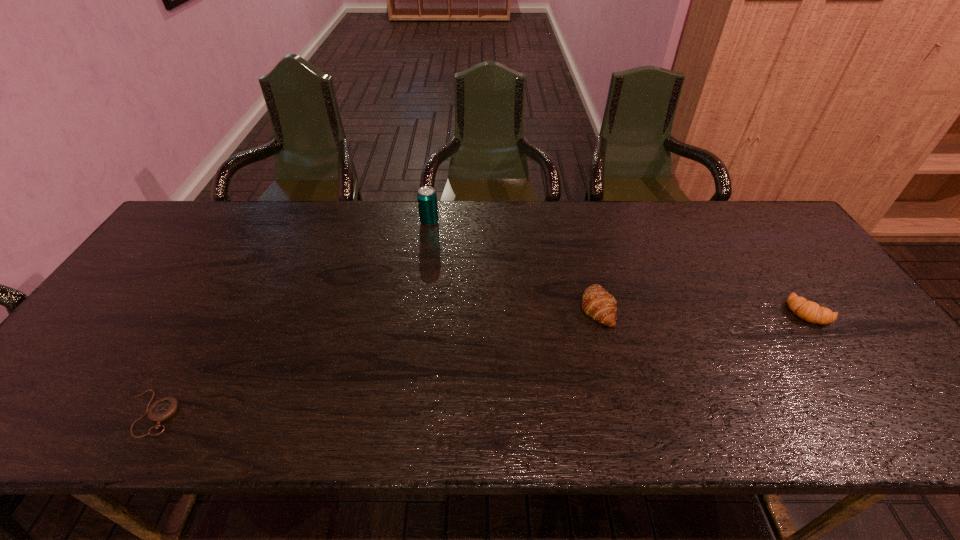
The image size is (960, 540). Find the location of `free space between the rightmost object and the shortest object`. free space between the rightmost object and the shortest object is located at coordinates (480, 362).

Image resolution: width=960 pixels, height=540 pixels. What are the coordinates of `free spot between the beer can and the nearest object` in the screenshot? It's located at (290, 317).

You are a GUI agent. You are given a task and a screenshot of the screen. Output one action in this format:
    pyautogui.click(x=<x>, y=<y>)
    Task: Click on the empty location between the left crescent roll and the rightmost object
    
    Given the screenshot: What is the action you would take?
    pyautogui.click(x=704, y=310)

The width and height of the screenshot is (960, 540). What are the coordinates of `free space between the shorter crescent roll and the second object from left to right` in the screenshot? It's located at (619, 267).

Where is `free point between the shortest object and the right crescent roll`? free point between the shortest object and the right crescent roll is located at coordinates (480, 362).

The image size is (960, 540). I want to click on vacant space that is in between the second object from left to right and the second object from right to left, so click(514, 265).

Locate an element on the screen. vacant point located between the third shortest object and the third tallest object is located at coordinates (704, 310).

Where is `unoccupied area between the third tallest object and the taller crescent roll`? The image size is (960, 540). unoccupied area between the third tallest object and the taller crescent roll is located at coordinates (704, 310).

Where is `free space between the shorter crescent roll and the farthest object`? Image resolution: width=960 pixels, height=540 pixels. free space between the shorter crescent roll and the farthest object is located at coordinates (619, 267).

Point out which object is positioned as the nearest to the taller crescent roll. Please provide its 2D coordinates. Your answer should be formatted as a tuple, i.e. [(x, y)], where the tuple contains the x and y coordinates of a point satisfying the conditions above.

[(809, 311)]